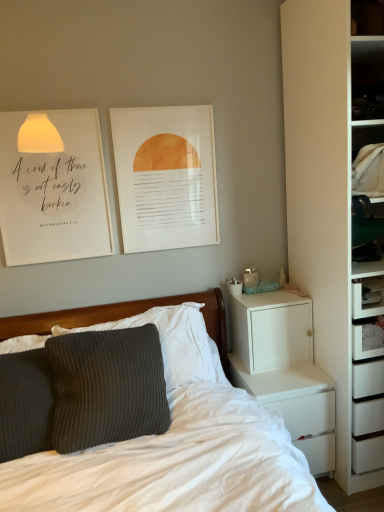
Question: Is white paper at upper left wider than white matte chest of drawers at right?

Choices:
 (A) no
 (B) yes

Answer: (A)

Question: Does white paper at upper left have a larger size compared to white matte chest of drawers at right?

Choices:
 (A) no
 (B) yes

Answer: (A)

Question: Is white paper at upper left smaller than white matte chest of drawers at right?

Choices:
 (A) no
 (B) yes

Answer: (B)

Question: From a real-world perspective, is white paper at upper left beneath white matte chest of drawers at right?

Choices:
 (A) yes
 (B) no

Answer: (B)

Question: Is white paper at upper left looking in the opposite direction of white matte chest of drawers at right?

Choices:
 (A) no
 (B) yes

Answer: (A)

Question: In the image, is matte paper picture frame at upper center on the left side or the right side of white matte cabinet at right?

Choices:
 (A) right
 (B) left

Answer: (B)

Question: Looking at the image, does matte paper picture frame at upper center seem bigger or smaller compared to white matte cabinet at right?

Choices:
 (A) small
 (B) big

Answer: (A)

Question: Is matte paper picture frame at upper center wider or thinner than white matte cabinet at right?

Choices:
 (A) wide
 (B) thin

Answer: (B)

Question: Do you think matte paper picture frame at upper center is within white matte cabinet at right, or outside of it?

Choices:
 (A) outside
 (B) inside

Answer: (A)

Question: Is white matte cabinet at right in front of or behind dark grey textured pillow at left in the image?

Choices:
 (A) behind
 (B) front

Answer: (A)

Question: From a real-world perspective, is white matte cabinet at right above or below dark grey textured pillow at left?

Choices:
 (A) above
 (B) below

Answer: (B)

Question: Does point (297, 334) appear closer or farther from the camera than point (28, 356)?

Choices:
 (A) closer
 (B) farther

Answer: (B)

Question: From the image's perspective, relative to dark grey textured pillow at left, is white matte cabinet at right above or below?

Choices:
 (A) above
 (B) below

Answer: (A)

Question: Considering the positions of point (301, 415) and point (11, 121), is point (301, 415) closer or farther from the camera than point (11, 121)?

Choices:
 (A) closer
 (B) farther

Answer: (B)

Question: Is white matte chest of drawers at right in front of or behind white paper at upper left in the image?

Choices:
 (A) front
 (B) behind

Answer: (B)